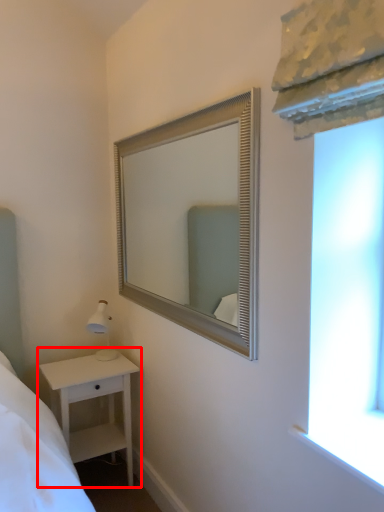
Question: Where is nightstand (annotated by the red box) located in relation to mirror in the image?

Choices:
 (A) left
 (B) right

Answer: (A)